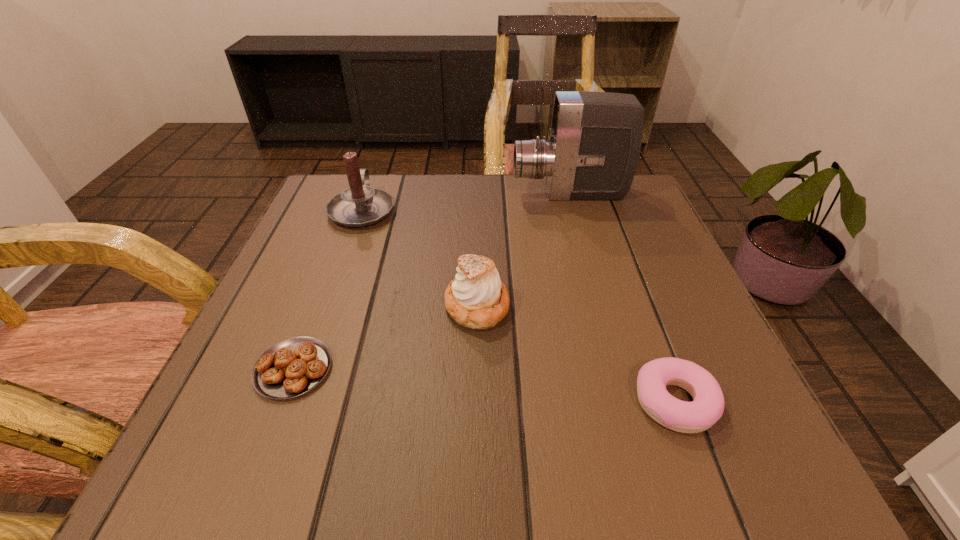
Find the location of a particular element. This screenshot has width=960, height=540. vacant region located at the front of the camcorder, highlighting the lens is located at coordinates (420, 194).

Find the location of a particular element. The width and height of the screenshot is (960, 540). vacant area situated 0.080m on the side of the candle with the handle loop is located at coordinates (375, 174).

Locate an element on the screen. vacant region located 0.050m on the side of the candle with the handle loop is located at coordinates (373, 180).

You are a GUI agent. You are given a task and a screenshot of the screen. Output one action in this format:
    pyautogui.click(x=<x>, y=<y>)
    Task: Click on the free space located on the side of the candle with the handle loop
    
    Given the screenshot: What is the action you would take?
    pyautogui.click(x=374, y=176)

Locate an element on the screen. The image size is (960, 540). free space located 0.120m on the front of the second pastry from right to left is located at coordinates (476, 395).

This screenshot has height=540, width=960. In order to click on vacant area located 0.240m on the left of the rightmost pastry in this screenshot , I will do `click(467, 402)`.

Find the location of a particular element. This screenshot has width=960, height=540. vacant space located on the front of the shortest object is located at coordinates (263, 449).

Where is `camcorder located in the far edge section of the desktop`? camcorder located in the far edge section of the desktop is located at coordinates (594, 143).

Where is `candle that is at the far edge`? Image resolution: width=960 pixels, height=540 pixels. candle that is at the far edge is located at coordinates (359, 205).

Locate an element on the screen. The width and height of the screenshot is (960, 540). object at the near edge is located at coordinates point(699,415).